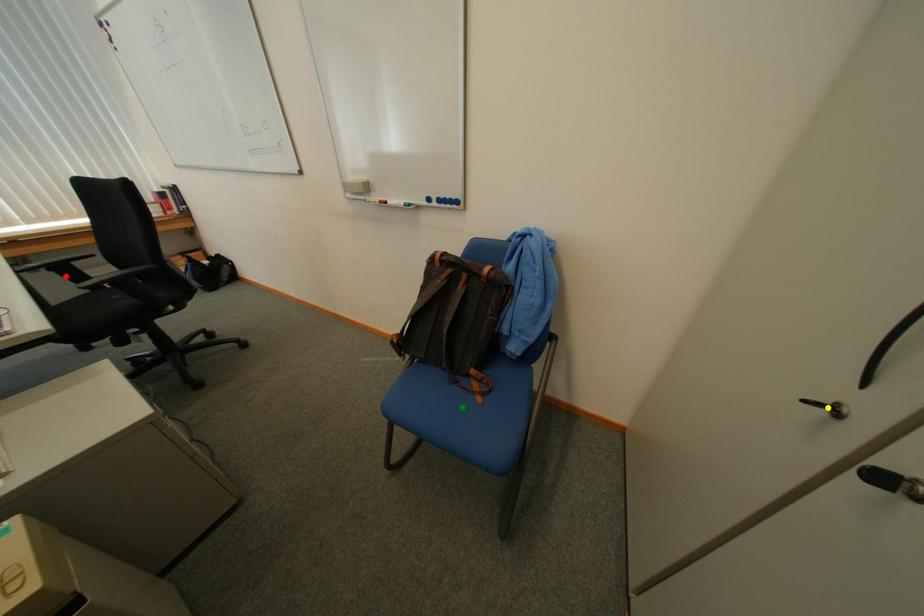
Order these from nearest to farthest:
yellow point | red point | green point

yellow point < green point < red point